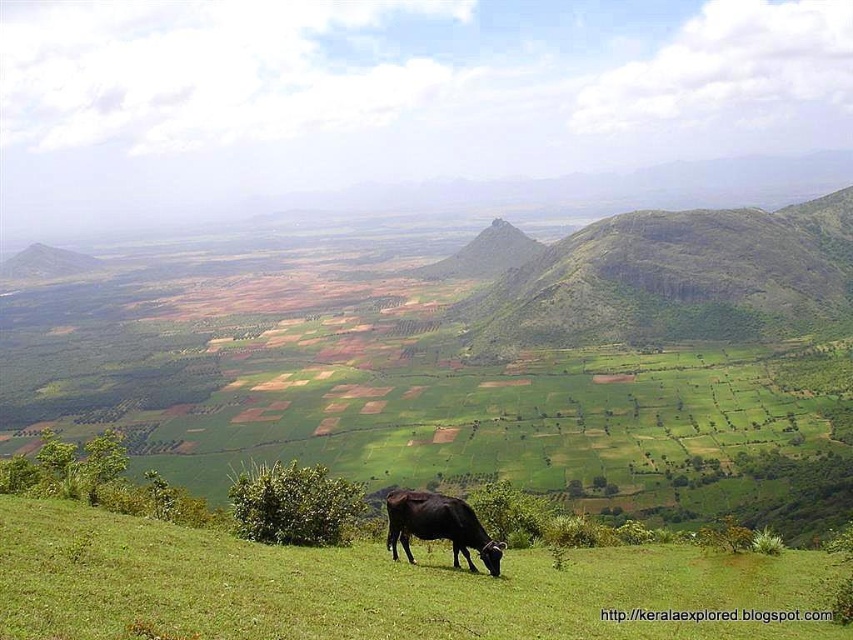
Does green grassy field at lower center appear under green grassy hill at upper center?

Yes.

Image resolution: width=853 pixels, height=640 pixels. What do you see at coordinates (366, 586) in the screenshot?
I see `green grassy field at lower center` at bounding box center [366, 586].

What are the coordinates of `green grassy field at lower center` in the screenshot? It's located at (366, 586).

Which is in front, point (288, 586) or point (471, 516)?

Point (288, 586)

Describe the element at coordinates (366, 586) in the screenshot. I see `green grassy field at lower center` at that location.

Which is in front, point (456, 612) or point (415, 518)?

Positioned in front is point (456, 612).

Where is `green grassy field at lower center`? green grassy field at lower center is located at coordinates (366, 586).

Which is behind, point (605, 289) or point (413, 515)?

The point (605, 289) is behind.

Between point (831, 320) and point (409, 525), which one is positioned in front?

Point (409, 525)

The height and width of the screenshot is (640, 853). Find the location of `green grassy hill at upper center`. green grassy hill at upper center is located at coordinates (676, 280).